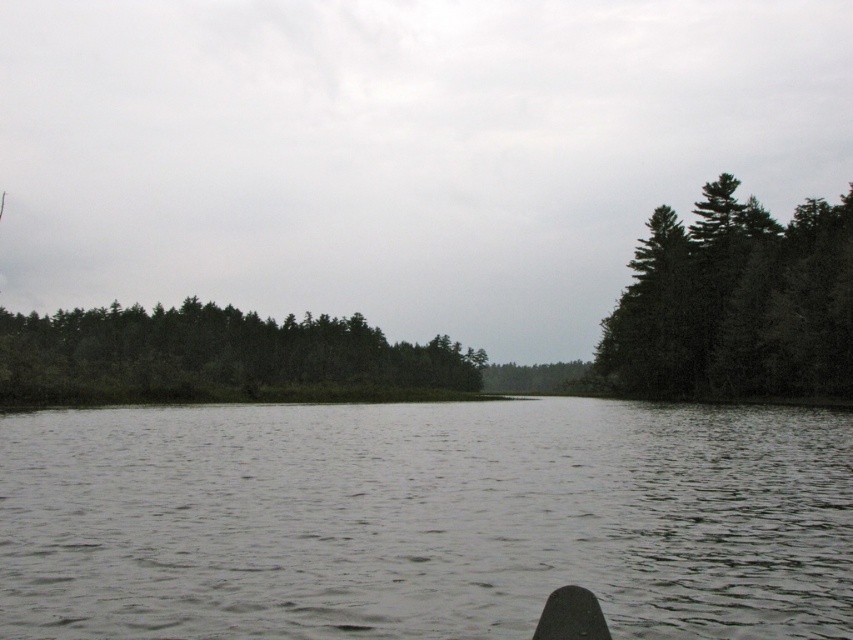
You are standing on the lakeshore and see the dark green textured trees at right and the green matte trees at center. Which group of trees is closer to your right side?

The dark green textured trees at right are to the right of the green matte trees at center, so they are closer to your right side.

You are a hiker standing at the edge of the dark green textured trees at right. You want to cross to the other side of the gray matte water at center. If your walking speed is 1.5 meters per second, how long will it take you to reach the opposite bank?

The gray matte water at center is 38.94 meters from dark green textured trees at right. At a walking speed of 1.5 meters per second, it would take approximately 25.96 seconds to cross the water and reach the opposite bank.